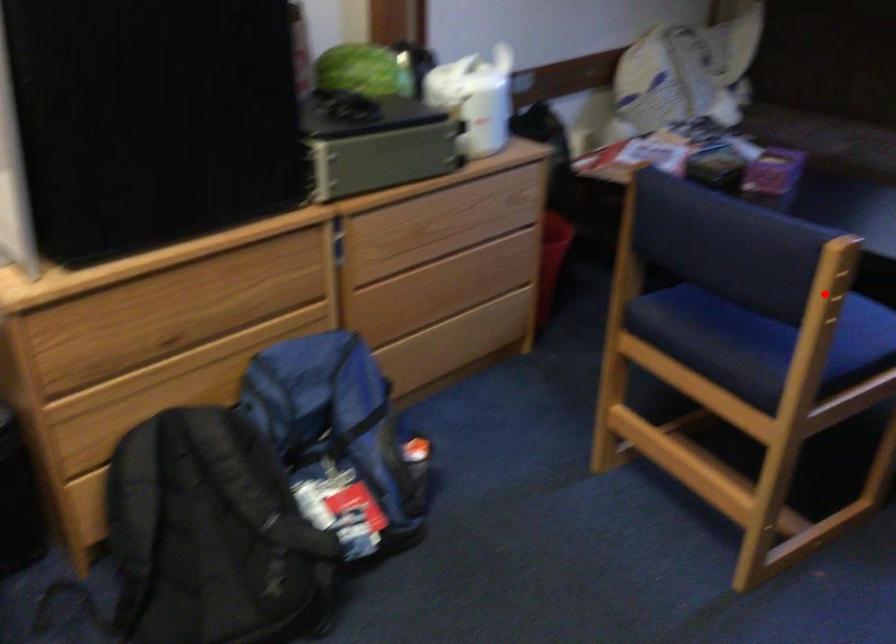
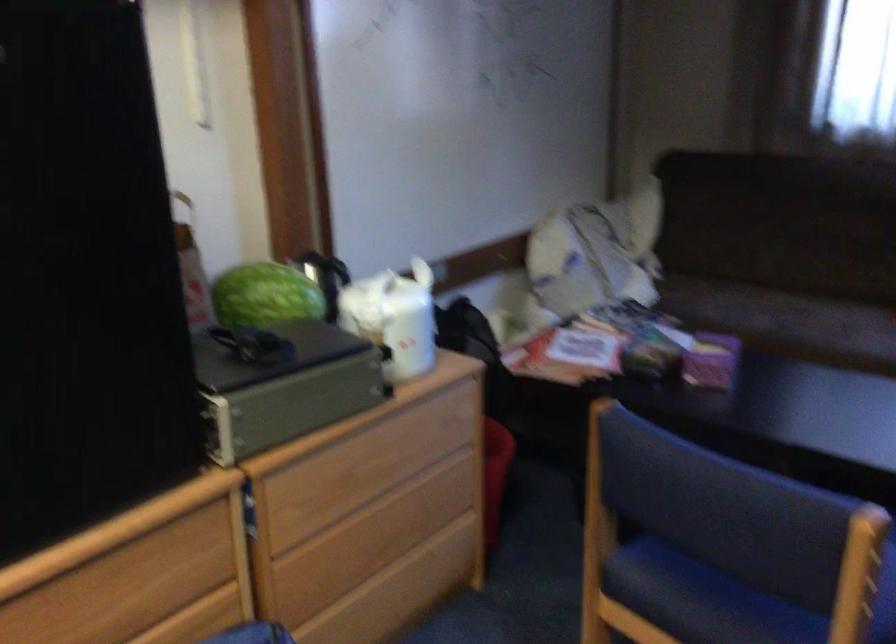
Question: I am providing you with two images of the same scene from different viewpoints. A red point is shown in image1. For the corresponding object point in image2, is it positioned nearer or farther from the camera?

Choices:
 (A) Nearer
 (B) Farther

Answer: (A)